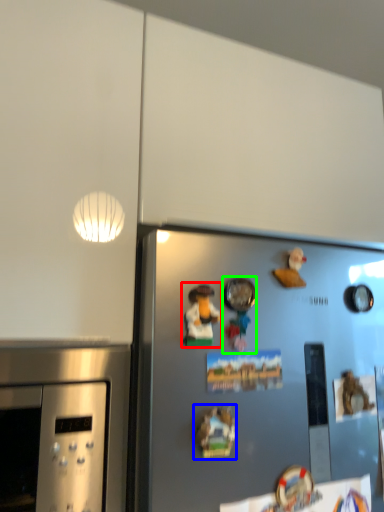
Question: Considering the real-world distances, which object is farthest from art (highlighted by a red box)? art (highlighted by a blue box) or toy (highlighted by a green box)?

Choices:
 (A) art
 (B) toy

Answer: (A)